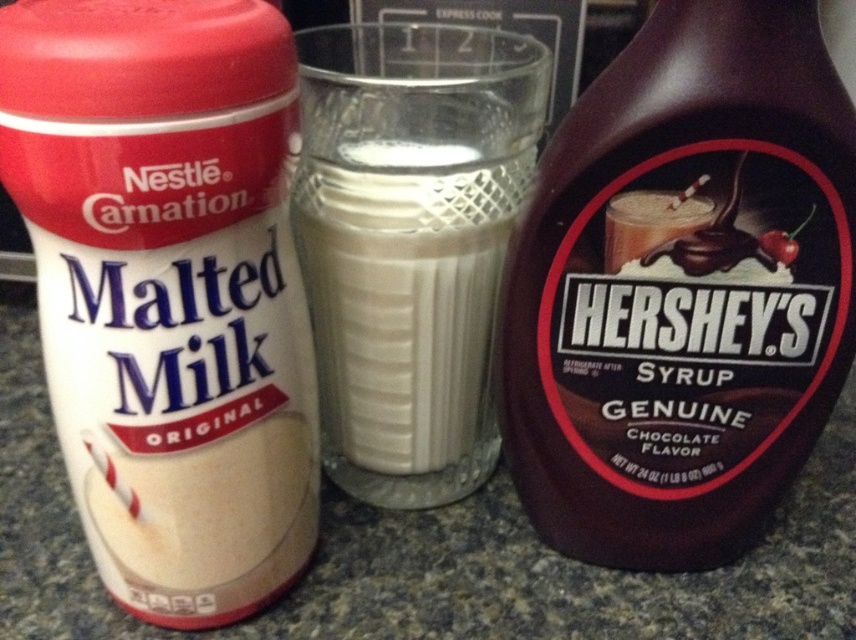
You are arranging items on a kitchen counter and have the white matte malted milk powder at left and the dark brown syrup at right. Which item is positioned more to the left side of the counter?

The white matte malted milk powder at left is positioned more to the left side of the counter.

You are a delivery person who needs to place a new item on the countertop. The new item requires a spot that is at least 20 inches away from the camera. Can the spot at point (541, 252) be used?

The distance of point (541, 252) from the camera is 19.90 inches, which is less than the required 20 inches. Therefore, the spot cannot be used.